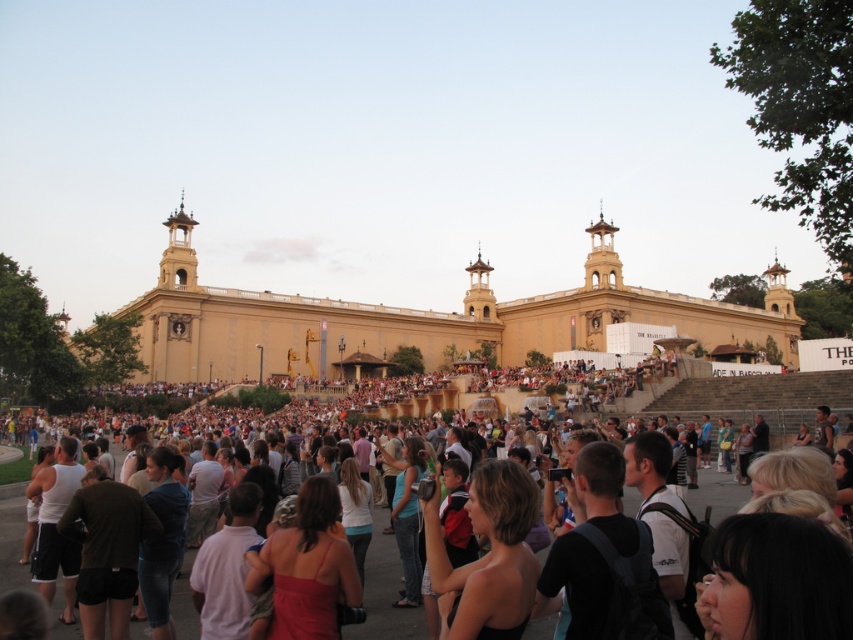
Question: Among these points, which one is farthest from the camera?

Choices:
 (A) (256, 310)
 (B) (68, 634)

Answer: (A)

Question: Can you confirm if golden stone church at center is positioned above light brown hair at lower center?

Choices:
 (A) no
 (B) yes

Answer: (B)

Question: Does golden stone church at center appear on the left side of light brown hair at lower center?

Choices:
 (A) yes
 (B) no

Answer: (B)

Question: Is golden stone church at center to the left of light brown hair at lower center from the viewer's perspective?

Choices:
 (A) yes
 (B) no

Answer: (B)

Question: Which point is farther from the camera taking this photo?

Choices:
 (A) (724, 502)
 (B) (207, 333)

Answer: (B)